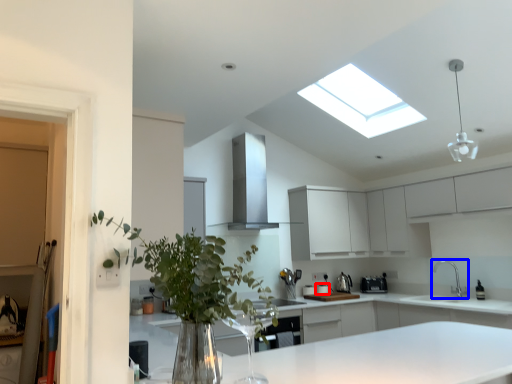
Question: Which object is closer to the camera taking this photo, appliance (highlighted by a red box) or tap (highlighted by a blue box)?

Choices:
 (A) appliance
 (B) tap

Answer: (B)